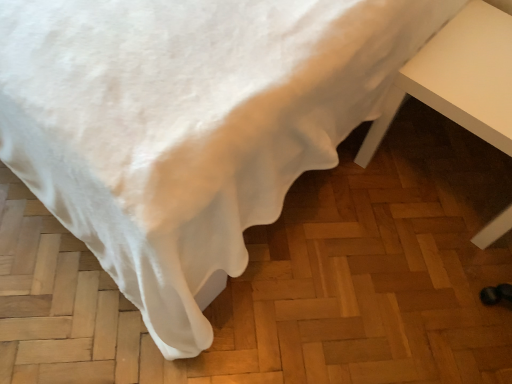
Image resolution: width=512 pixels, height=384 pixels. Identify the location of white matte table at lower right. (459, 78).

What do you see at coordinates (459, 78) in the screenshot? I see `white matte table at lower right` at bounding box center [459, 78].

I want to click on white matte table at lower right, so click(459, 78).